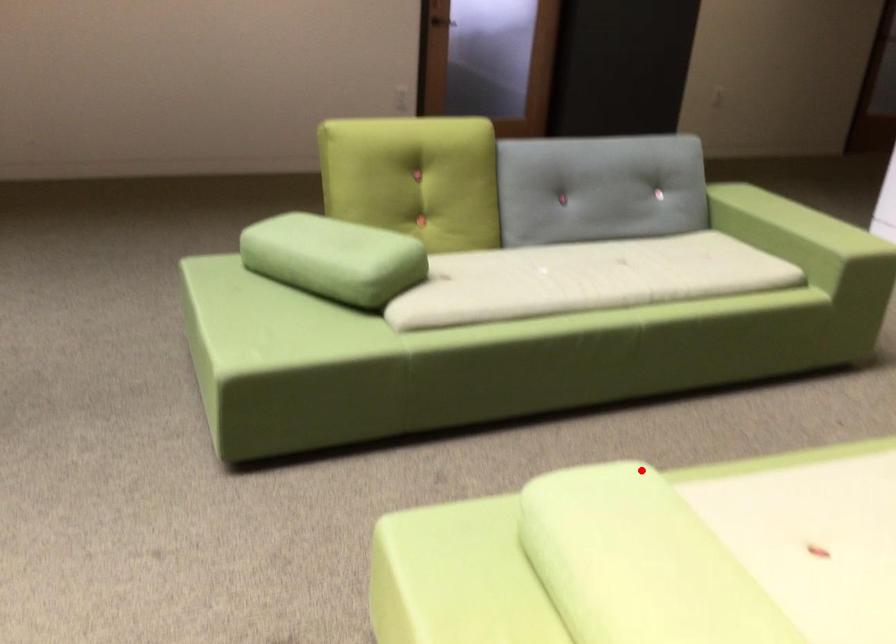
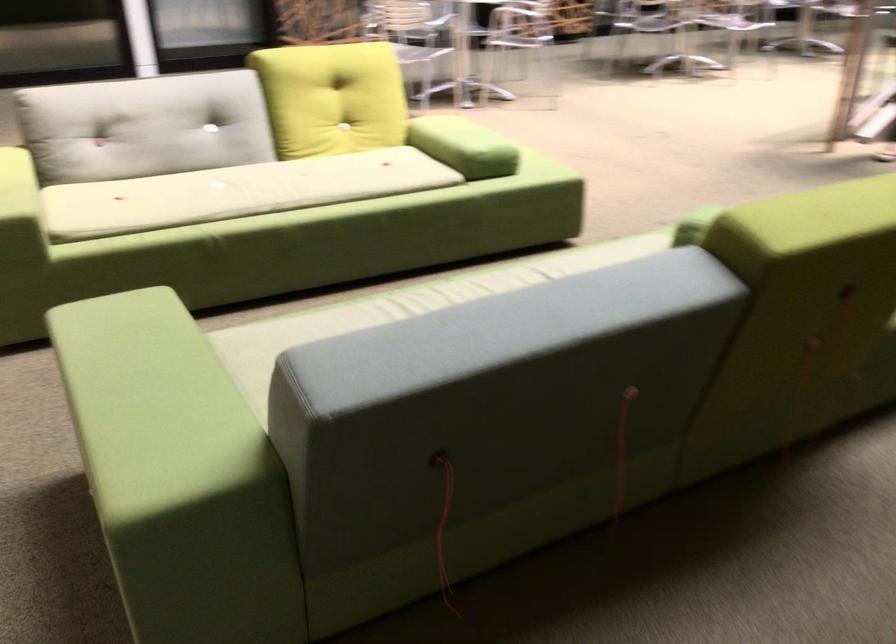
Find the pixel in the second image that matches the highlighted location in the first image.

(464, 146)